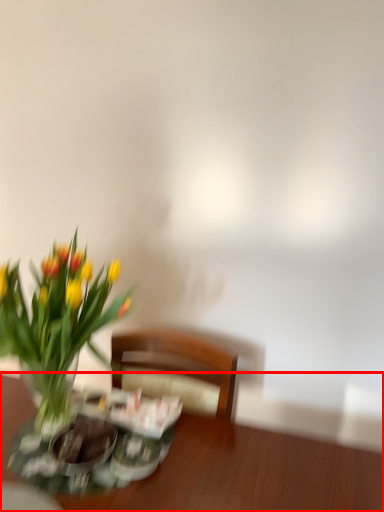
Question: From the image's perspective, what is the correct spatial relationship of table (annotated by the red box) in relation to flower?

Choices:
 (A) above
 (B) below

Answer: (B)